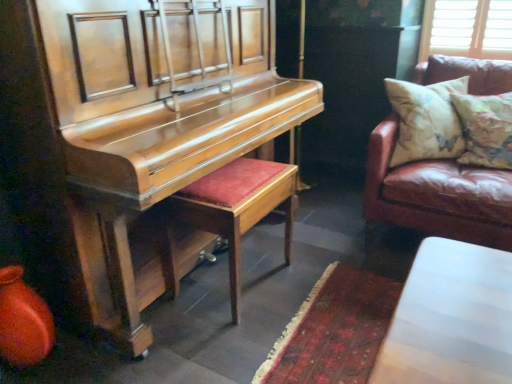
Image resolution: width=512 pixels, height=384 pixels. Find the location of `vacant area to the right of velvet red stool at center`. vacant area to the right of velvet red stool at center is located at coordinates (317, 280).